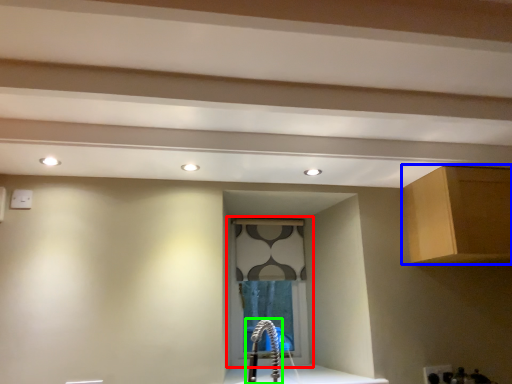
Question: Which is farther away from window (highlighted by a red box)? cabinetry (highlighted by a blue box) or faucet (highlighted by a green box)?

Choices:
 (A) cabinetry
 (B) faucet

Answer: (A)